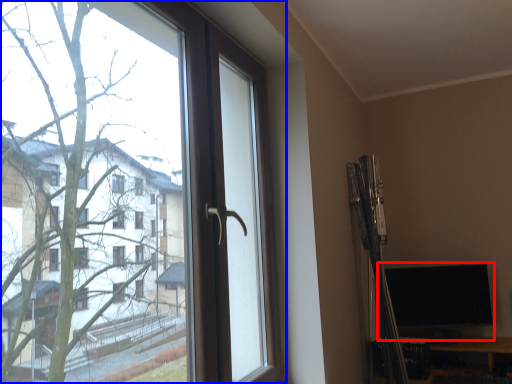
Question: Which object appears closest to the camera in this image, computer monitor (highlighted by a red box) or window (highlighted by a blue box)?

Choices:
 (A) computer monitor
 (B) window

Answer: (B)